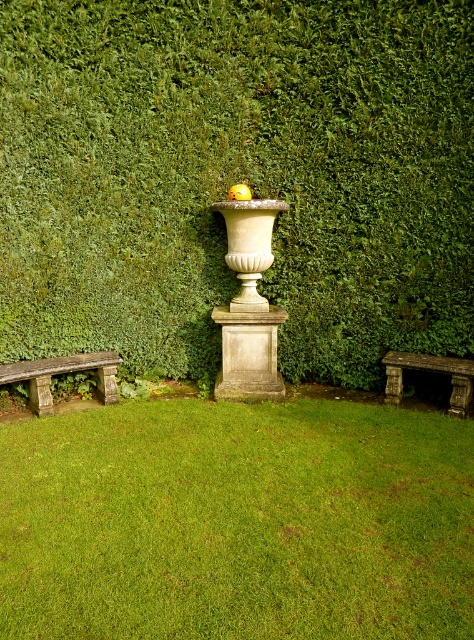
Consider the image. You are a gardener who needs to water the green grass at center and the rusty stone bench at lower right. Your watering can holds enough water for 3 feet of travel. Starting from the bench, can you reach the grass without refilling?

The distance between the green grass at center and the rusty stone bench at lower right is 4.13 feet. Since the watering can allows 3 feet of travel, you cannot reach the grass from the bench without refilling.

You are standing in the garden and want to take a photo of the green leafy hedge at center. The camera you are using has a minimum focusing distance of 10 feet. Can you take a clear photo without moving closer?

The distance between the green leafy hedge at center and the camera is 15.19 feet, which is greater than the minimum focusing distance of 10 feet. Therefore, you can take a clear photo without moving closer.